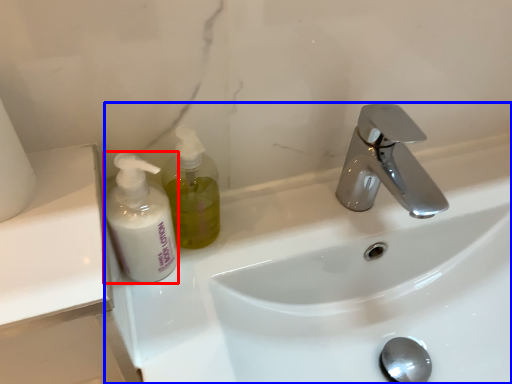
Question: Among these objects, which one is nearest to the camera, cleaning product (highlighted by a red box) or sink (highlighted by a blue box)?

Choices:
 (A) cleaning product
 (B) sink

Answer: (B)